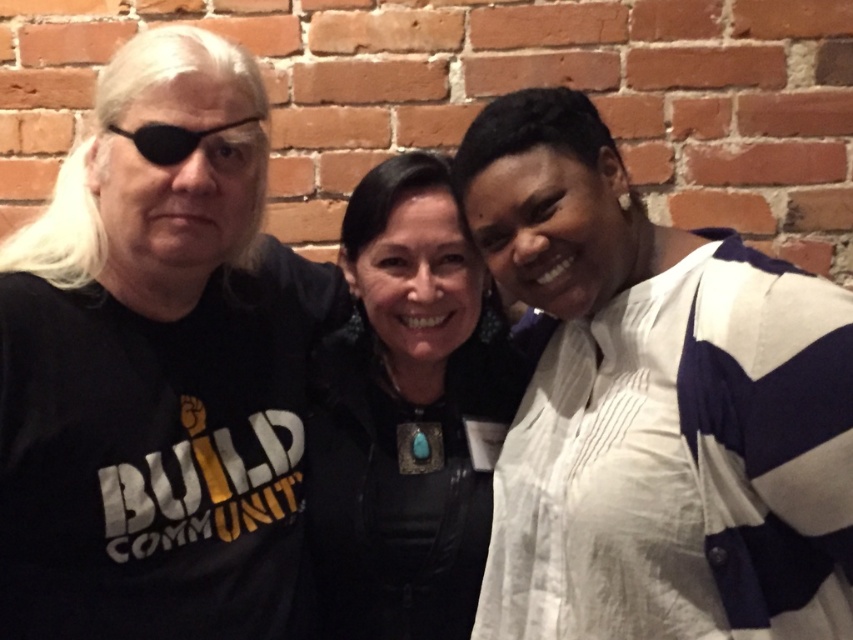
Is black matte t-shirt at left to the right of black plastic eyepatch at left from the viewer's perspective?

In fact, black matte t-shirt at left is to the left of black plastic eyepatch at left.

In the scene shown: Can you confirm if black matte t-shirt at left is smaller than black plastic eyepatch at left?

No.

What do you see at coordinates (157, 371) in the screenshot?
I see `black matte t-shirt at left` at bounding box center [157, 371].

Locate an element on the screen. This screenshot has width=853, height=640. black matte t-shirt at left is located at coordinates (157, 371).

Does black matte t-shirt at left have a greater width compared to black leather jacket at center?

Correct, the width of black matte t-shirt at left exceeds that of black leather jacket at center.

In the scene shown: Which is more to the right, black matte t-shirt at left or black leather jacket at center?

black leather jacket at center is more to the right.

Describe the element at coordinates (157, 371) in the screenshot. Image resolution: width=853 pixels, height=640 pixels. I see `black matte t-shirt at left` at that location.

You are a GUI agent. You are given a task and a screenshot of the screen. Output one action in this format:
    pyautogui.click(x=<x>, y=<y>)
    Task: Click on the black matte t-shirt at left
    
    Given the screenshot: What is the action you would take?
    pyautogui.click(x=157, y=371)

Looking at this image, can you confirm if black leather jacket at center is thinner than black plastic eyepatch at left?

Incorrect, black leather jacket at center's width is not less than black plastic eyepatch at left's.

How distant is black leather jacket at center from black plastic eyepatch at left?

18.78 inches

Looking at this image, who is more distant from viewer, [361,564] or [160,124]?

Point [361,564]

Locate an element on the screen. black leather jacket at center is located at coordinates (408, 413).